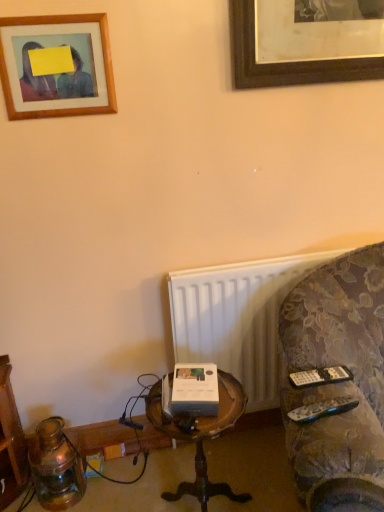
Question: Is wooden picture frame at upper left in contact with black plastic remote at lower right, the second remote positioned from the back?

Choices:
 (A) no
 (B) yes

Answer: (A)

Question: From the image's perspective, does wooden picture frame at upper left appear lower than black plastic remote at lower right, which appears as the first remote when viewed from the front?

Choices:
 (A) no
 (B) yes

Answer: (A)

Question: Is wooden picture frame at upper left not inside black plastic remote at lower right, which appears as the first remote when viewed from the front?

Choices:
 (A) yes
 (B) no

Answer: (A)

Question: Is wooden picture frame at upper left behind black plastic remote at lower right, the second remote positioned from the back?

Choices:
 (A) no
 (B) yes

Answer: (B)

Question: Can you confirm if wooden picture frame at upper left is taller than black plastic remote at lower right, the second remote positioned from the back?

Choices:
 (A) no
 (B) yes

Answer: (B)

Question: Does wooden picture frame at upper left have a lesser height compared to black plastic remote at lower right, which appears as the first remote when viewed from the front?

Choices:
 (A) yes
 (B) no

Answer: (B)

Question: Is black plastic remote at lower right, the second remote positioned from the back, closer to camera compared to black plastic remote at right, the 1th remote in the back-to-front sequence?

Choices:
 (A) yes
 (B) no

Answer: (A)

Question: Can you confirm if black plastic remote at lower right, the second remote positioned from the back, is positioned to the right of black plastic remote at right, the 1th remote in the back-to-front sequence?

Choices:
 (A) no
 (B) yes

Answer: (A)

Question: Is there a large distance between black plastic remote at lower right, which appears as the first remote when viewed from the front, and black plastic remote at right, which is the 2th remote from front to back?

Choices:
 (A) yes
 (B) no

Answer: (B)

Question: Is black plastic remote at lower right, which appears as the first remote when viewed from the front, facing away from black plastic remote at right, the 1th remote in the back-to-front sequence?

Choices:
 (A) no
 (B) yes

Answer: (B)

Question: Considering the relative sizes of black plastic remote at lower right, which appears as the first remote when viewed from the front, and black plastic remote at right, the 1th remote in the back-to-front sequence, in the image provided, is black plastic remote at lower right, which appears as the first remote when viewed from the front, wider than black plastic remote at right, the 1th remote in the back-to-front sequence,?

Choices:
 (A) no
 (B) yes

Answer: (A)

Question: Is black plastic remote at lower right, the second remote positioned from the back, taller than black plastic remote at right, the 1th remote in the back-to-front sequence?

Choices:
 (A) no
 (B) yes

Answer: (A)

Question: Does velvet-patterned couch at right have a lesser height compared to black plastic remote at right, which is the 2th remote from front to back?

Choices:
 (A) yes
 (B) no

Answer: (B)